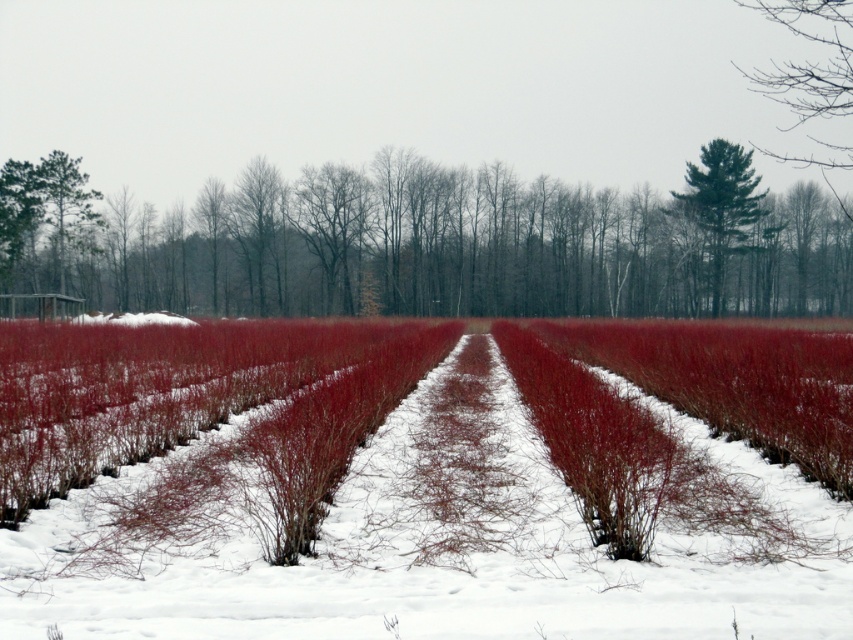
Question: Does smooth bark tree at left appear on the right side of green textured pine tree at upper center?

Choices:
 (A) no
 (B) yes

Answer: (A)

Question: Is the position of smooth bark tree at left less distant than that of green textured pine tree at upper center?

Choices:
 (A) yes
 (B) no

Answer: (A)

Question: Is smooth bark tree at left below green textured pine tree at upper center?

Choices:
 (A) no
 (B) yes

Answer: (B)

Question: Which point is closer to the camera?

Choices:
 (A) (438, 170)
 (B) (715, 291)

Answer: (B)

Question: Among these objects, which one is farthest from the camera?

Choices:
 (A) smooth bark tree at left
 (B) green textured pine tree at upper center

Answer: (B)